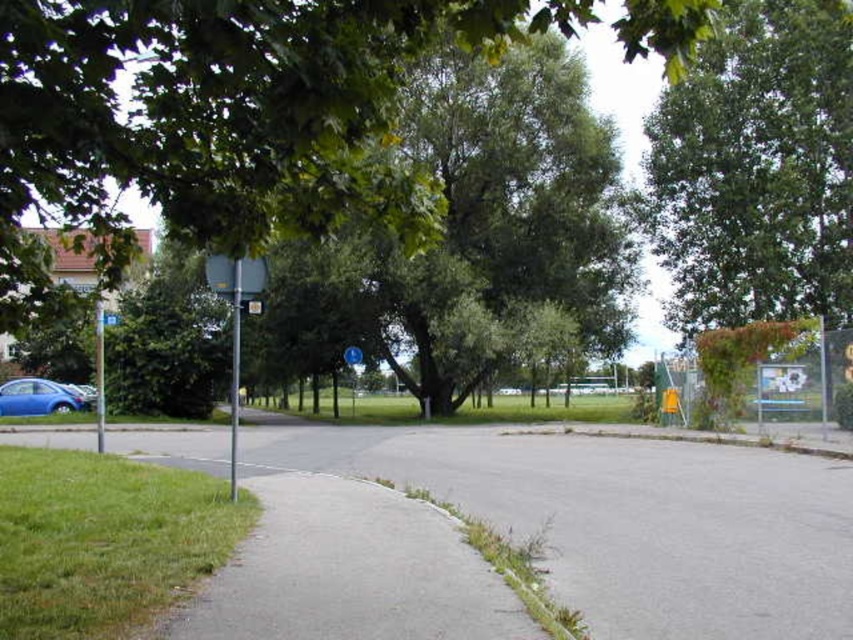
Which is above, green grass at lower left or metallic blue sign at center?

Positioned higher is metallic blue sign at center.

Who is positioned more to the right, green grass at lower left or metallic blue sign at center?

metallic blue sign at center is more to the right.

What do you see at coordinates (103, 540) in the screenshot? This screenshot has width=853, height=640. I see `green grass at lower left` at bounding box center [103, 540].

You are a GUI agent. You are given a task and a screenshot of the screen. Output one action in this format:
    pyautogui.click(x=<x>, y=<y>)
    Task: Click on the green grass at lower left
    The height and width of the screenshot is (640, 853).
    Given the screenshot: What is the action you would take?
    pyautogui.click(x=103, y=540)

Can you confirm if green leafy tree at upper right is positioned below green grass at lower left?

No.

Does green leafy tree at upper right have a larger size compared to green grass at lower left?

Yes.

Is point (766, 109) positioned before point (223, 499)?

No, (766, 109) is behind (223, 499).

Locate an element on the screen. Image resolution: width=853 pixels, height=640 pixels. green leafy tree at upper right is located at coordinates (757, 170).

I want to click on green leafy tree at upper right, so click(757, 170).

Is point (819, 314) in front of point (352, 364)?

Yes, it is.

The image size is (853, 640). In order to click on green leafy tree at upper right in this screenshot , I will do `click(757, 170)`.